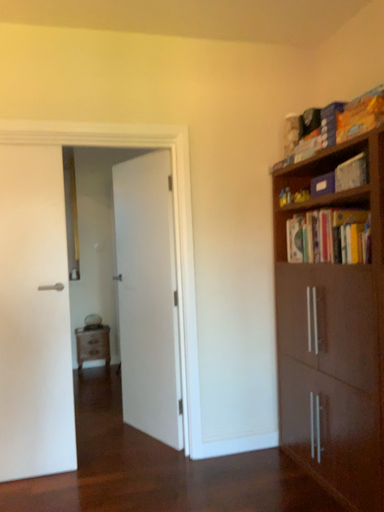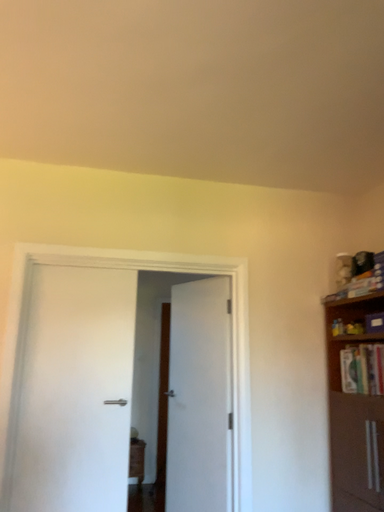
Question: How did the camera likely rotate when shooting the video?

Choices:
 (A) rotated downward
 (B) rotated upward

Answer: (B)